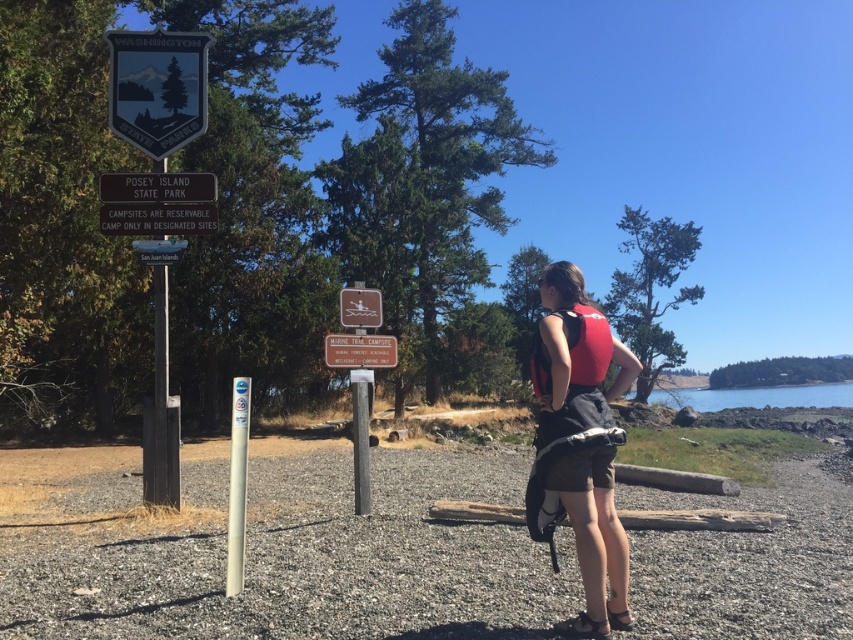
Question: Which object is positioned farthest from the metallic blue sign at upper center?

Choices:
 (A) white plastic sign at center
 (B) metallic silver sign at upper left
 (C) metallic brown sign at center

Answer: (A)

Question: Does clear blue water at lower right appear on the right side of metallic brown sign at center?

Choices:
 (A) yes
 (B) no

Answer: (A)

Question: Is clear blue water at lower right wider than metallic brown sign at center?

Choices:
 (A) yes
 (B) no

Answer: (A)

Question: Does clear blue water at lower right have a greater width compared to metallic brown sign at center?

Choices:
 (A) yes
 (B) no

Answer: (A)

Question: Among these objects, which one is nearest to the camera?

Choices:
 (A) metallic blue sign at upper center
 (B) metallic silver boat at center

Answer: (B)

Question: Estimate the real-world distances between objects in this image. Which object is farther from the matte red life vest at center?

Choices:
 (A) red matte vest at center
 (B) white plastic sign at center

Answer: (B)